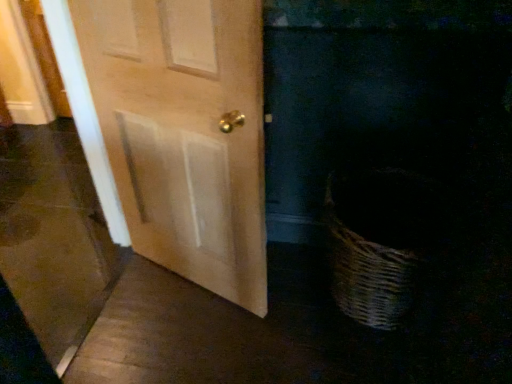
Question: Can you confirm if light wood door at center is positioned to the right of matte wood screen door at left?

Choices:
 (A) no
 (B) yes

Answer: (B)

Question: Is light wood door at center closer to camera compared to matte wood screen door at left?

Choices:
 (A) no
 (B) yes

Answer: (A)

Question: Is light wood door at center oriented away from matte wood screen door at left?

Choices:
 (A) yes
 (B) no

Answer: (B)

Question: Is light wood door at center directly adjacent to matte wood screen door at left?

Choices:
 (A) no
 (B) yes

Answer: (A)

Question: Considering the relative sizes of light wood door at center and matte wood screen door at left in the image provided, is light wood door at center thinner than matte wood screen door at left?

Choices:
 (A) yes
 (B) no

Answer: (A)

Question: Does light wood door at center turn towards matte wood screen door at left?

Choices:
 (A) no
 (B) yes

Answer: (B)

Question: From a real-world perspective, is matte wood screen door at left over light wood door at center?

Choices:
 (A) yes
 (B) no

Answer: (B)

Question: Considering the relative sizes of matte wood screen door at left and light wood door at center in the image provided, is matte wood screen door at left bigger than light wood door at center?

Choices:
 (A) yes
 (B) no

Answer: (A)

Question: From a real-world perspective, is matte wood screen door at left located beneath light wood door at center?

Choices:
 (A) no
 (B) yes

Answer: (B)

Question: Is matte wood screen door at left oriented away from light wood door at center?

Choices:
 (A) no
 (B) yes

Answer: (B)

Question: Can you confirm if matte wood screen door at left is taller than light wood door at center?

Choices:
 (A) yes
 (B) no

Answer: (A)

Question: Is matte wood screen door at left to the right of light wood door at center from the viewer's perspective?

Choices:
 (A) no
 (B) yes

Answer: (A)

Question: From the image's perspective, relative to matte wood screen door at left, is light wood door at center above or below?

Choices:
 (A) below
 (B) above

Answer: (B)